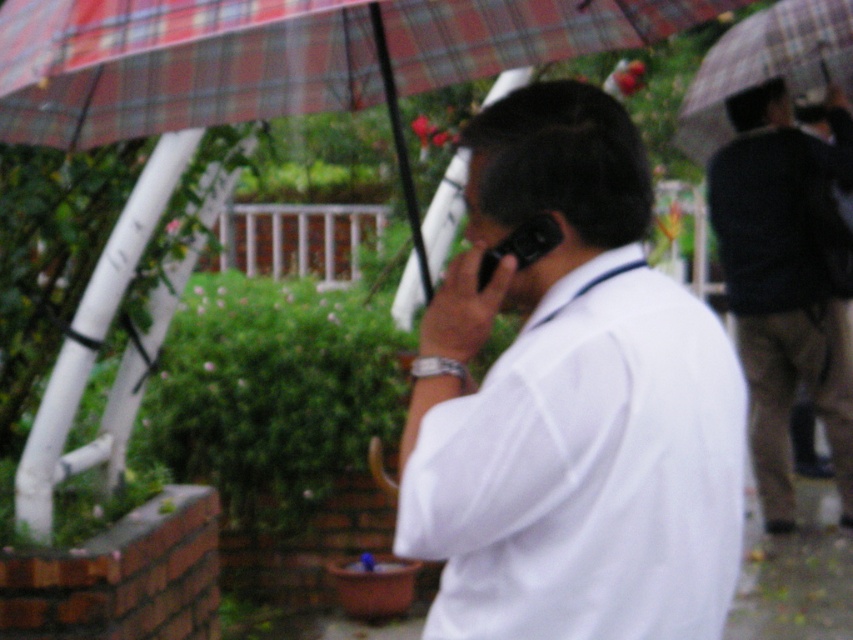
Who is more forward, (480,397) or (367,67)?

Positioned in front is point (480,397).

Does white matte shirt at center have a larger size compared to plaid fabric umbrella at upper center?

Incorrect, white matte shirt at center is not larger than plaid fabric umbrella at upper center.

Does point (440, 524) come behind point (445, 67)?

No.

At what (x,y) coordinates should I click in order to perform the action: click on white matte shirt at center. Please return your answer as a coordinate pair (x, y). The width and height of the screenshot is (853, 640). Looking at the image, I should click on (572, 404).

Between point (444, 12) and point (770, 300), which one is positioned in front?

Point (444, 12) is in front.

Who is taller, plaid fabric umbrella at upper center or dark brown pants at right?

With more height is dark brown pants at right.

The width and height of the screenshot is (853, 640). What do you see at coordinates (280, 54) in the screenshot?
I see `plaid fabric umbrella at upper center` at bounding box center [280, 54].

Locate an element on the screen. Image resolution: width=853 pixels, height=640 pixels. plaid fabric umbrella at upper center is located at coordinates (280, 54).

Which is above, white matte shirt at center or dark brown pants at right?

Positioned higher is dark brown pants at right.

Which is more to the left, white matte shirt at center or dark brown pants at right?

white matte shirt at center is more to the left.

Image resolution: width=853 pixels, height=640 pixels. What do you see at coordinates (572, 404) in the screenshot?
I see `white matte shirt at center` at bounding box center [572, 404].

This screenshot has height=640, width=853. Identify the location of white matte shirt at center. (572, 404).